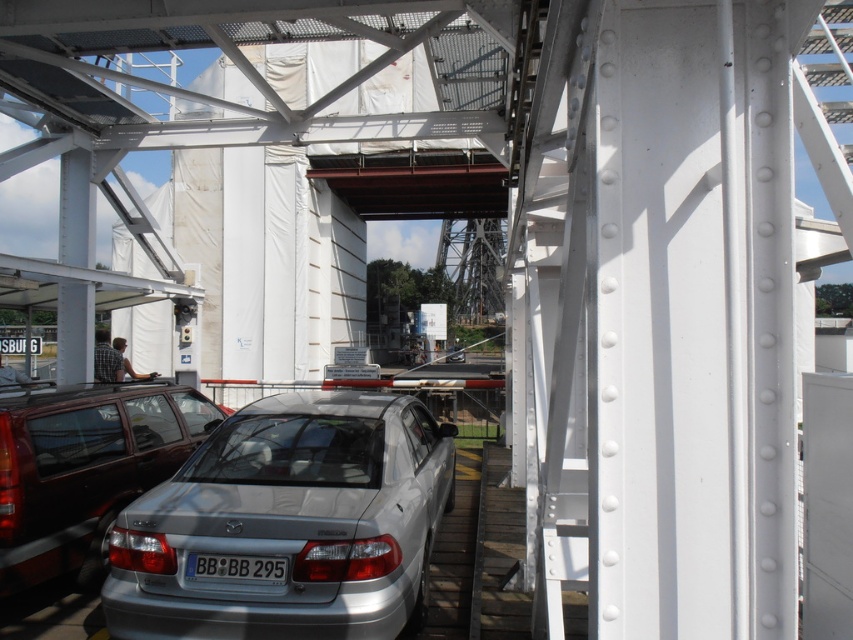
Based on the photo, can you confirm if satin silver sedan at lower center is wider than white plastic license plate at center?

Yes, satin silver sedan at lower center is wider than white plastic license plate at center.

Between point (15, 444) and point (241, 573), which one is positioned in front?

Point (241, 573) is in front.

Is point (13, 560) closer to camera compared to point (193, 568)?

No, it is not.

The image size is (853, 640). What are the coordinates of `satin silver sedan at lower center` in the screenshot? It's located at (85, 468).

Which of these two, silver metallic car at center or satin silver sedan at lower center, stands taller?

satin silver sedan at lower center

Is silver metallic car at center above satin silver sedan at lower center?

No, silver metallic car at center is not above satin silver sedan at lower center.

Locate an element on the screen. silver metallic car at center is located at coordinates (289, 524).

Locate an element on the screen. silver metallic car at center is located at coordinates (289, 524).

Does silver metallic car at center appear on the left side of white plastic license plate at center?

Incorrect, silver metallic car at center is not on the left side of white plastic license plate at center.

Describe the element at coordinates (289, 524) in the screenshot. I see `silver metallic car at center` at that location.

Identify the location of silver metallic car at center. (289, 524).